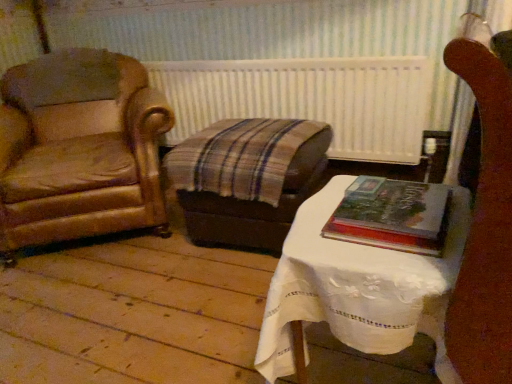
Find the location of a particular element. The image size is (512, 384). vacant space in front of brown leather armchair at left is located at coordinates (123, 301).